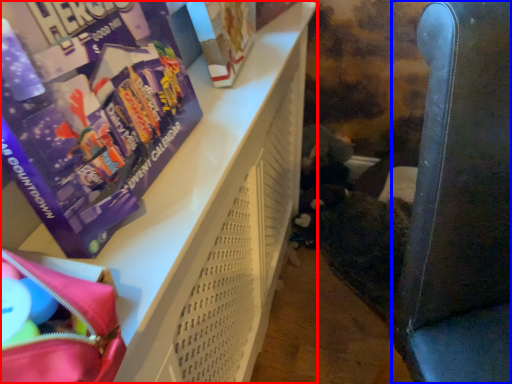
Question: Which object appears farthest to the camera in this image, furniture (highlighted by a red box) or armchair (highlighted by a blue box)?

Choices:
 (A) furniture
 (B) armchair

Answer: (A)